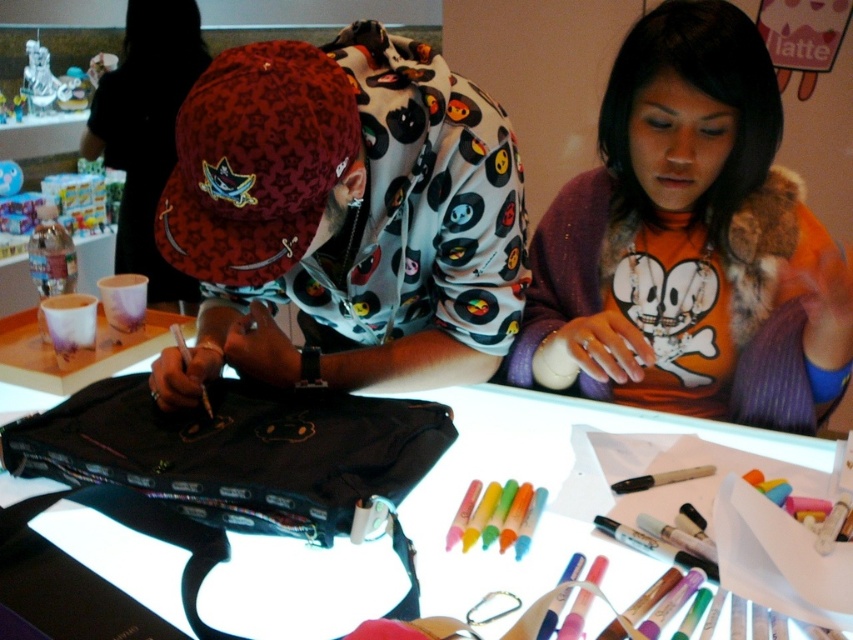
You are a fashion designer analyzing this image. You need to determine which item is shorter in height between the orange fabric shirt at center and the matte red cap at upper left. Based on the scene, which one is shorter?

The orange fabric shirt at center has a lesser height compared to the matte red cap at upper left, so the orange fabric shirt at center is shorter in height.

You are standing 5 feet away from the table where the two people are working. If you want to reach the point at coordinates point [712,172], will you be able to do so without moving closer?

The distance of point [712,172] from viewer is 3.65 feet, so since you are currently 5 feet away, you need to move 1.35 feet closer to reach it.

In the scene shown: You are an observer looking at the scene. There is a white paper at center and a matte red cap at upper left. Which object is positioned higher in the image?

The matte red cap at upper left is positioned higher than the white paper at center.